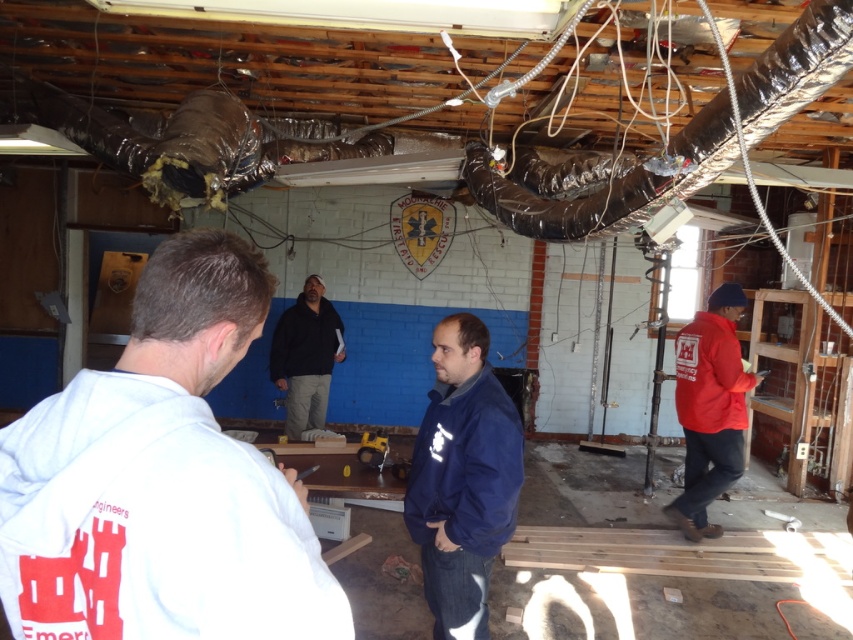
What do you see at coordinates (167, 481) in the screenshot? The image size is (853, 640). I see `white fleece jacket at upper left` at bounding box center [167, 481].

Does white fleece jacket at upper left have a greater width compared to navy blue fleece jacket at center?

Indeed, white fleece jacket at upper left has a greater width compared to navy blue fleece jacket at center.

Between point (148, 289) and point (467, 480), which one is positioned behind?

The point (467, 480) is behind.

I want to click on white fleece jacket at upper left, so (167, 481).

Between navy blue fleece jacket at center and black matte jacket at center, which one appears on the right side from the viewer's perspective?

navy blue fleece jacket at center is more to the right.

Image resolution: width=853 pixels, height=640 pixels. Describe the element at coordinates (466, 465) in the screenshot. I see `navy blue fleece jacket at center` at that location.

The image size is (853, 640). I want to click on navy blue fleece jacket at center, so coord(466,465).

Between white fleece jacket at upper left and black matte jacket at center, which one has less height?

white fleece jacket at upper left

Between point (21, 531) and point (299, 323), which one is positioned behind?

The point (299, 323) is more distant.

Is point (99, 566) in front of point (294, 323)?

Yes, it is in front of point (294, 323).

Where is `white fleece jacket at upper left`? This screenshot has height=640, width=853. white fleece jacket at upper left is located at coordinates (167, 481).